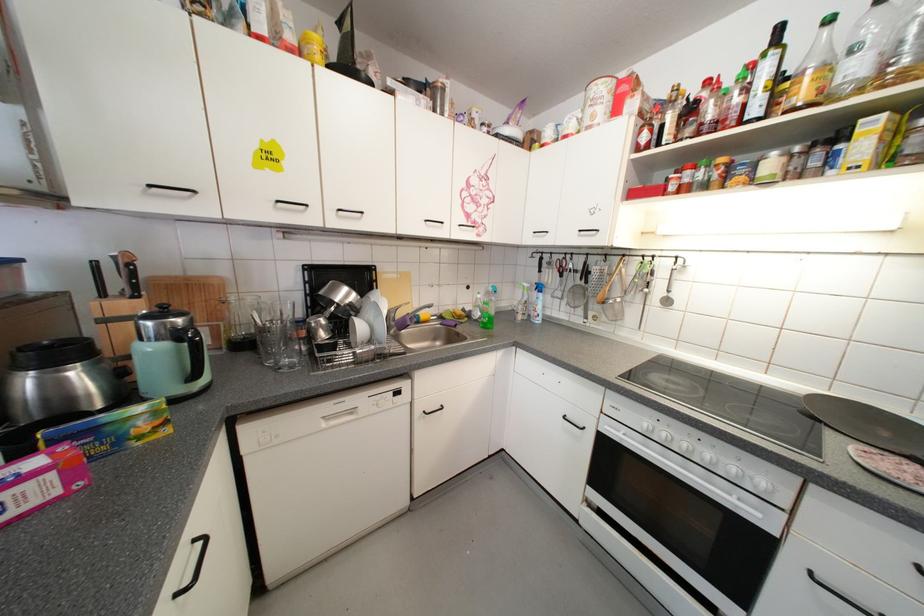
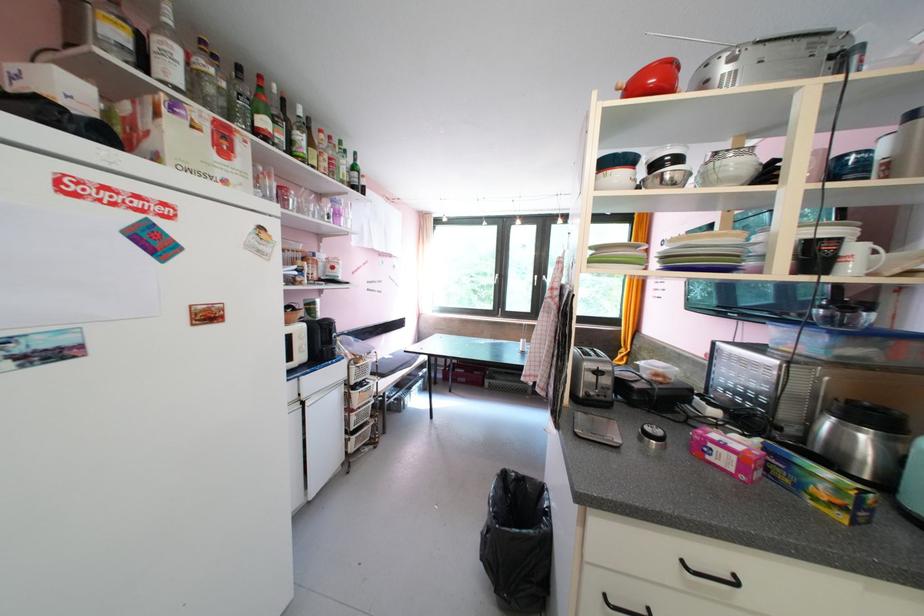
The point at [175,434] is marked in the first image. Where is the corresponding point in the second image?

(849, 519)